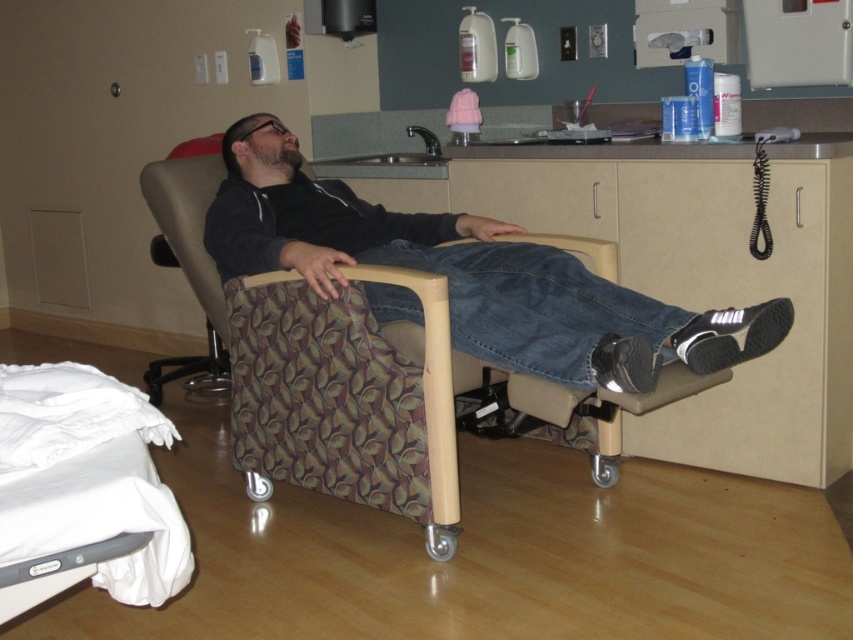
Question: Is matte black hoodie at center to the right of patterned fabric swivel chair at center from the viewer's perspective?

Choices:
 (A) yes
 (B) no

Answer: (A)

Question: Is white fabric hospital bed at lower left in front of patterned fabric swivel chair at center?

Choices:
 (A) no
 (B) yes

Answer: (B)

Question: Which point is farther from the camera taking this photo?

Choices:
 (A) (538, 209)
 (B) (227, 170)
 (C) (437, 381)
 (D) (74, 474)

Answer: (A)

Question: Which object is the farthest from the white fabric hospital bed at lower left?

Choices:
 (A) matte plastic drawer at center
 (B) matte black hoodie at center

Answer: (A)

Question: Which of the following is the farthest from the observer?

Choices:
 (A) (612, 445)
 (B) (77, 506)
 (C) (256, 173)
 (D) (567, 205)

Answer: (D)

Question: Does white fabric hospital bed at lower left have a larger size compared to matte plastic drawer at center?

Choices:
 (A) no
 (B) yes

Answer: (B)